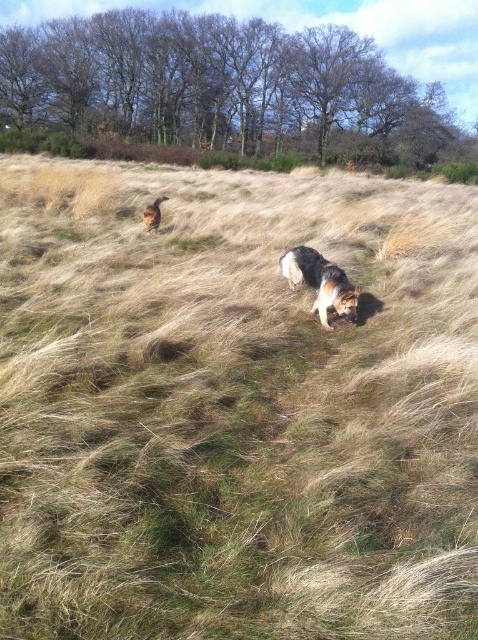
Question: Which object is closer to the camera taking this photo?

Choices:
 (A) brown fur dog at upper center
 (B) black and tan fur dog at center

Answer: (B)

Question: Can you confirm if black and tan fur dog at center is positioned to the right of brown fur dog at upper center?

Choices:
 (A) no
 (B) yes

Answer: (B)

Question: Among these objects, which one is farthest from the camera?

Choices:
 (A) brown fur dog at upper center
 (B) black and tan fur dog at center

Answer: (A)

Question: Can you confirm if black and tan fur dog at center is thinner than brown fur dog at upper center?

Choices:
 (A) yes
 (B) no

Answer: (B)

Question: Can you confirm if black and tan fur dog at center is wider than brown fur dog at upper center?

Choices:
 (A) no
 (B) yes

Answer: (B)

Question: Which object is closer to the camera taking this photo?

Choices:
 (A) brown fur dog at upper center
 (B) black and tan fur dog at center

Answer: (B)